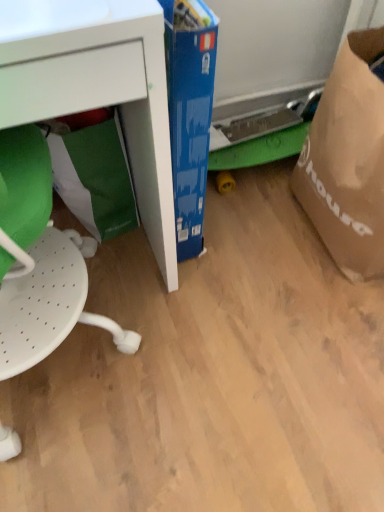
Identify the location of vacant area located to the right-hand side of blue cardboard box at center. (245, 228).